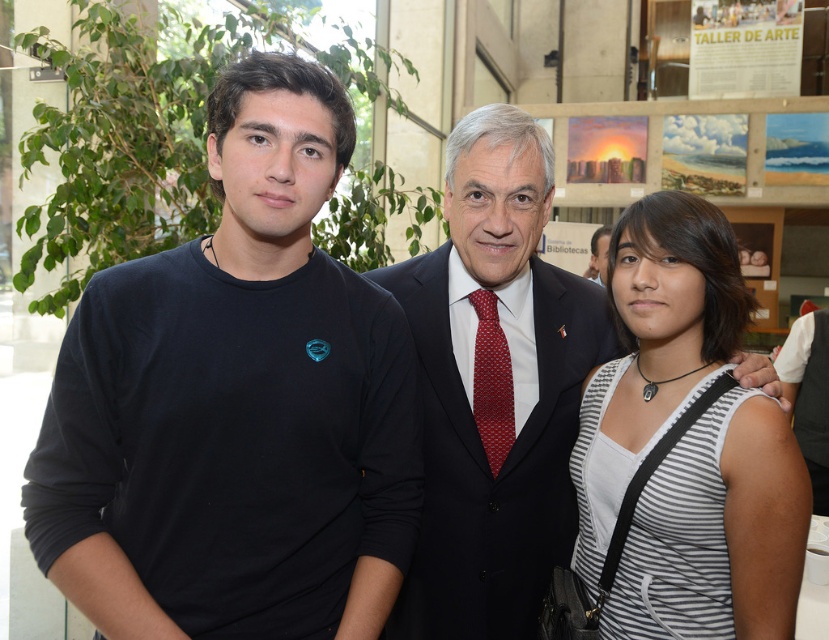
Who is positioned more to the left, red textured tie at center or matte black suit at center?

Positioned to the left is red textured tie at center.

Which is in front, point (500, 433) or point (588, 273)?

Point (500, 433) is more forward.

Image resolution: width=829 pixels, height=640 pixels. I want to click on red textured tie at center, so click(x=491, y=380).

Is smooth black suit at center further to the viewer compared to white striped tank top at right?

That is True.

Where is `smooth black suit at center`? smooth black suit at center is located at coordinates (512, 388).

Is point (444, 449) closer to viewer compared to point (745, 500)?

No, it is behind (745, 500).

Locate an element on the screen. This screenshot has width=829, height=640. smooth black suit at center is located at coordinates (512, 388).

How far apart are smooth black suit at center and red textured tie at center?

smooth black suit at center is 5.02 inches away from red textured tie at center.

Is smooth black suit at center to the left of red textured tie at center from the viewer's perspective?

In fact, smooth black suit at center is to the right of red textured tie at center.

Who is more forward, (468, 168) or (493, 454)?

Answer: Point (468, 168)

The width and height of the screenshot is (829, 640). I want to click on smooth black suit at center, so click(512, 388).